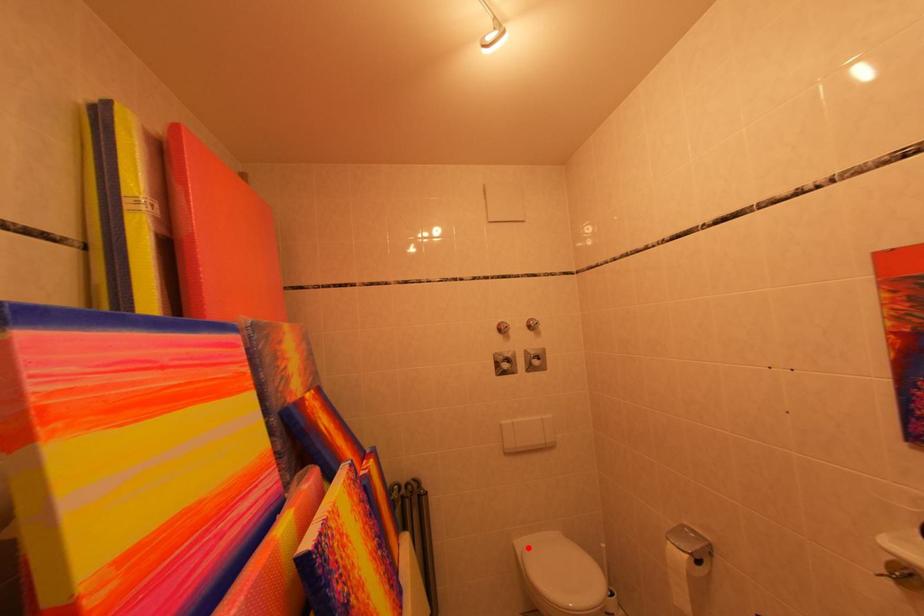
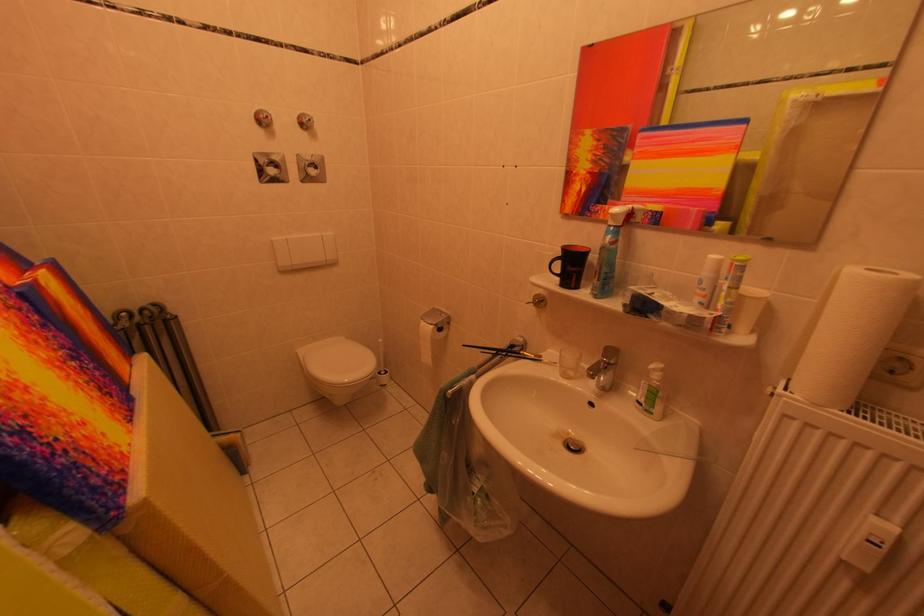
Question: I am providing you with two images of the same scene from different viewpoints. In image1, a red point is highlighted. Considering the same 3D point in image2, which of the following is correct?

Choices:
 (A) It is closer
 (B) It is farther

Answer: (A)